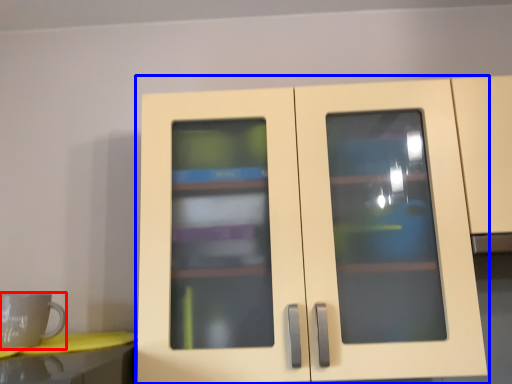
Question: Which point is closer to the camera, mug (highlighted by a red box) or cupboard (highlighted by a blue box)?

Choices:
 (A) mug
 (B) cupboard

Answer: (B)